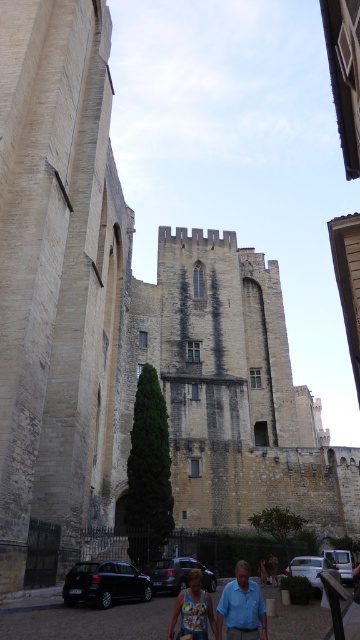
You are standing in front of a historic stone building and notice a person wearing a printed fabric tank top at lower center and blue denim jeans at lower center. Based on their clothing, can you determine if the tank top is positioned higher than the jeans?

The printed fabric tank top at lower center is above blue denim jeans at lower center, so yes, the tank top is positioned higher than the jeans.

You are standing at the entrance of the historic stone building and see the printed fabric tank top at lower center and the blue denim jeans at lower center. Which item is closer to you?

The printed fabric tank top at lower center is closer to you since it is only 74.63 feet away from the blue denim jeans at lower center, but since both are at the same location, they are equally distant from you.

You are standing in front of the historic stone building and want to determine the relative positions of two points marked on the facade. Which point, point [182,634] or point [263,580], is closer to you?

Point [182,634] is closer to the viewer than point [263,580].